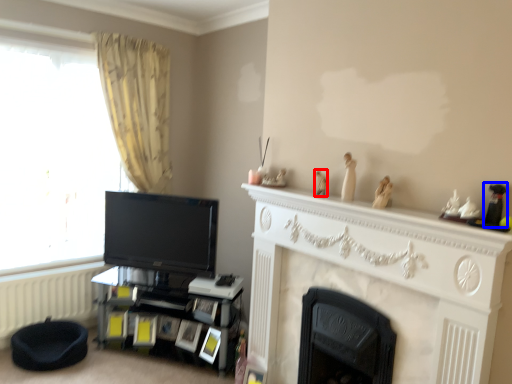
Question: Which of the following is the farthest to the observer, toy (highlighted by a red box) or toy (highlighted by a blue box)?

Choices:
 (A) toy
 (B) toy

Answer: (A)